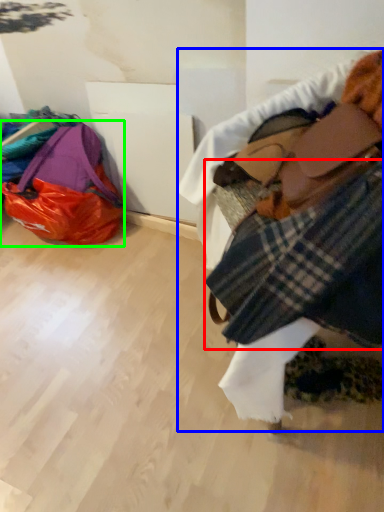
Question: Estimate the real-world distances between objects in this image. Which object is farther from flannel (highlighted by a red box), textile (highlighted by a blue box) or luggage and bags (highlighted by a green box)?

Choices:
 (A) textile
 (B) luggage and bags

Answer: (B)